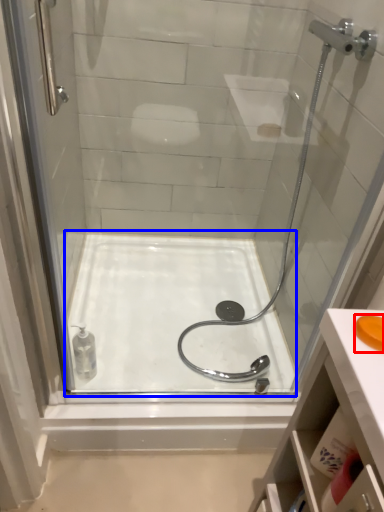
Question: Which object is closer to the camera taking this photo, soap (highlighted by a red box) or bath (highlighted by a blue box)?

Choices:
 (A) soap
 (B) bath

Answer: (A)